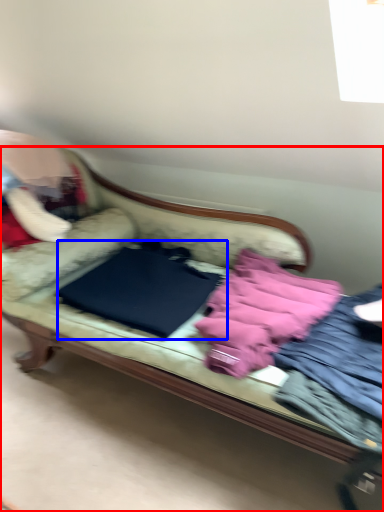
Question: Which of the following is the farthest to the observer, studio couch (highlighted by a red box) or sheet (highlighted by a blue box)?

Choices:
 (A) studio couch
 (B) sheet

Answer: (B)